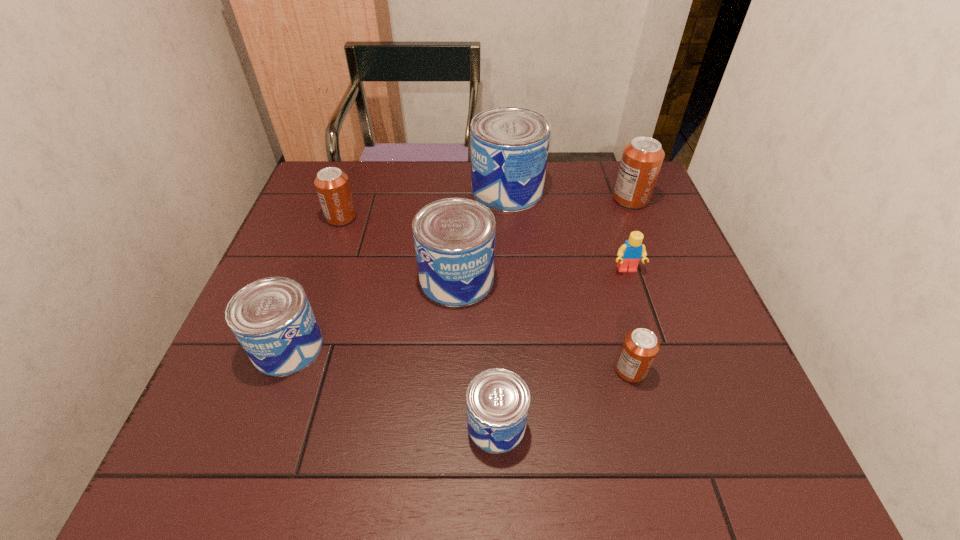
Find the location of a particular element. The width and height of the screenshot is (960, 540). the second can from right to left is located at coordinates (640, 347).

You are a GUI agent. You are given a task and a screenshot of the screen. Output one action in this format:
    pyautogui.click(x=<x>, y=<y>)
    Task: Click on the smallest orange can
    This screenshot has height=540, width=960.
    Given the screenshot: What is the action you would take?
    pyautogui.click(x=640, y=347)

Image resolution: width=960 pixels, height=540 pixels. I want to click on the nearest blue can, so click(x=497, y=400).

The height and width of the screenshot is (540, 960). What are the coordinates of `the smallest blue can` in the screenshot? It's located at (497, 400).

Identify the location of vacant space located on the front label of the farthest blue can. This screenshot has height=540, width=960. (442, 190).

Locate an element on the screen. The width and height of the screenshot is (960, 540). vacant space situated 0.320m on the front label of the farthest blue can is located at coordinates (365, 190).

This screenshot has height=540, width=960. Find the location of `free space located on the front label of the farthest blue can`. free space located on the front label of the farthest blue can is located at coordinates (405, 190).

Find the location of a particular element. This screenshot has width=960, height=540. vacant space located on the front of the rightmost can is located at coordinates (650, 248).

Where is `blank space located 0.110m on the front label of the second biggest blue can`? Image resolution: width=960 pixels, height=540 pixels. blank space located 0.110m on the front label of the second biggest blue can is located at coordinates (453, 347).

You are a GUI agent. You are given a task and a screenshot of the screen. Output one action in this format:
    pyautogui.click(x=<x>, y=<y>)
    Task: Click on the free space located on the right of the leftmost orange can
    This screenshot has width=960, height=540.
    Given the screenshot: What is the action you would take?
    pyautogui.click(x=389, y=218)